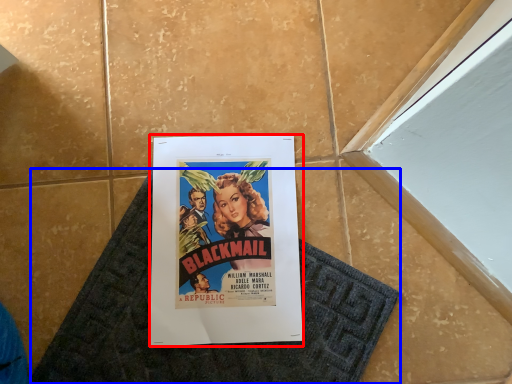
Question: Which of the following is the closest to the observer, poster (highlighted by a red box) or bath mat (highlighted by a blue box)?

Choices:
 (A) poster
 (B) bath mat

Answer: (B)